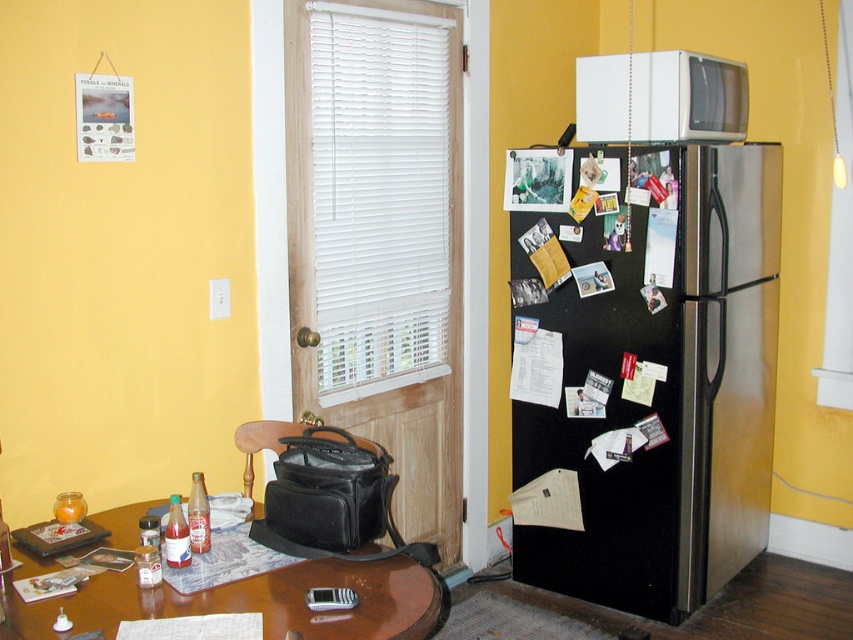
Which is behind, point (341, 564) or point (653, 54)?

The point (653, 54) is behind.

Between brown glossy table at lower left and white matte microwave at upper right, which one is positioned higher?

Positioned higher is white matte microwave at upper right.

Who is more distant from viewer, [68,596] or [601,60]?

The point [601,60] is behind.

Find the location of a particular element. This screenshot has height=640, width=853. brown glossy table at lower left is located at coordinates (239, 600).

This screenshot has width=853, height=640. Describe the element at coordinates (646, 376) in the screenshot. I see `black matte refrigerator at right` at that location.

Locate an element on the screen. The width and height of the screenshot is (853, 640). black matte refrigerator at right is located at coordinates (646, 376).

Who is more forward, (596, 342) or (605, 106)?

Positioned in front is point (596, 342).

The image size is (853, 640). What are the coordinates of `black matte refrigerator at right` in the screenshot? It's located at (646, 376).

Locate an element on the screen. The width and height of the screenshot is (853, 640). black matte refrigerator at right is located at coordinates (646, 376).

Describe the element at coordinates (646, 376) in the screenshot. The width and height of the screenshot is (853, 640). I see `black matte refrigerator at right` at that location.

At what (x,y) coordinates should I click in order to perform the action: click on black matte refrigerator at right. Please return your answer as a coordinate pair (x, y). Looking at the image, I should click on (646, 376).